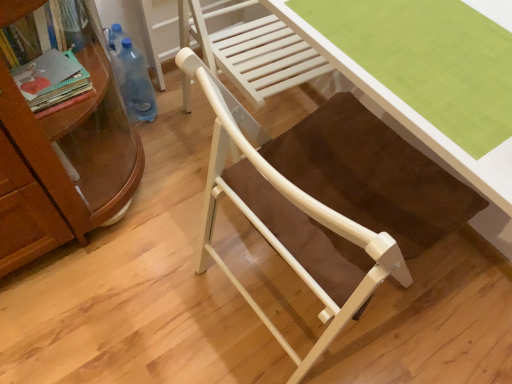
Question: Is blue plastic bottle at left situated inside matte white chair at center or outside?

Choices:
 (A) outside
 (B) inside

Answer: (A)

Question: Looking at the image, does blue plastic bottle at left seem bigger or smaller compared to matte white chair at center?

Choices:
 (A) small
 (B) big

Answer: (A)

Question: Which object is positioned closest to the blue plastic bottle at left?

Choices:
 (A) green fabric desk at center
 (B) matte white chair at center

Answer: (B)

Question: Which object is the farthest from the green fabric desk at center?

Choices:
 (A) blue plastic bottle at left
 (B) matte white chair at center

Answer: (A)